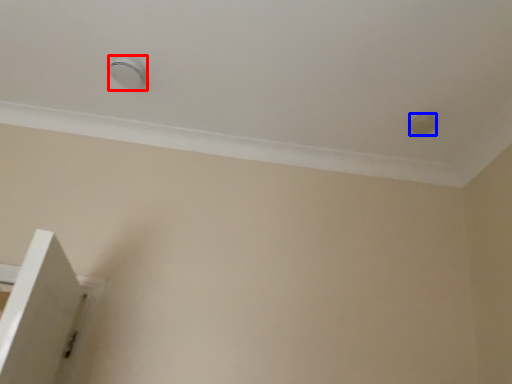
Question: Which object appears farthest to the camera in this image, knob (highlighted by a red box) or knob (highlighted by a blue box)?

Choices:
 (A) knob
 (B) knob

Answer: (B)